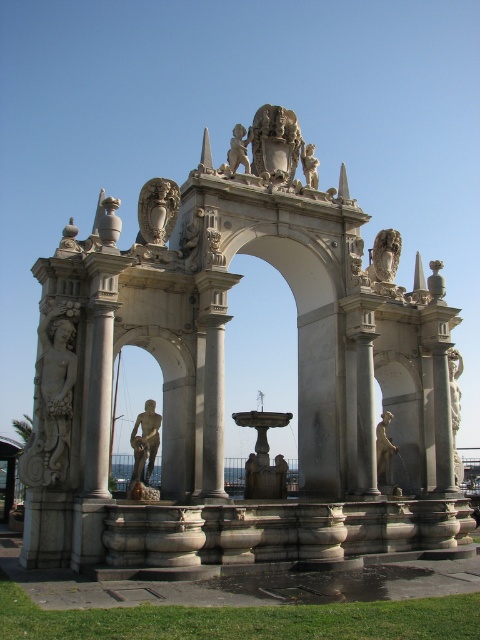
Can you confirm if white marble arch at center is smaller than polished stone fountain at center?

Incorrect, white marble arch at center is not smaller in size than polished stone fountain at center.

Which of these two, white marble arch at center or polished stone fountain at center, stands shorter?

Standing shorter between the two is polished stone fountain at center.

Find the location of a particular element. Image resolution: width=480 pixels, height=640 pixels. white marble arch at center is located at coordinates (223, 378).

In order to click on white marble arch at center in this screenshot , I will do `click(223, 378)`.

Is white marble arch at center behind white marble column at center?

No, it is not.

Does white marble arch at center appear on the right side of white marble column at center?

Correct, you'll find white marble arch at center to the right of white marble column at center.

Image resolution: width=480 pixels, height=640 pixels. Find the location of `white marble arch at center`. white marble arch at center is located at coordinates (223, 378).

Between carved stone figure at left and white marble statue at upper center, which one appears on the right side from the viewer's perspective?

white marble statue at upper center

Which is below, carved stone figure at left or white marble statue at upper center?

carved stone figure at left

Is point (74, 369) positioned after point (376, 236)?

No, it is in front of (376, 236).

In order to click on carved stone figure at left in this screenshot , I will do `click(52, 397)`.